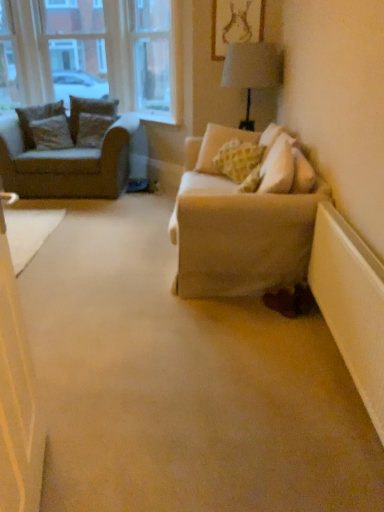
Question: From a real-world perspective, is velvet brown pillow at left, which ranks as the second pillow in right-to-left order, physically below brown textured pillow at left, the third pillow from the right?

Choices:
 (A) no
 (B) yes

Answer: (A)

Question: Is velvet brown pillow at left, which ranks as the second pillow in right-to-left order, at the right side of brown textured pillow at left, arranged as the second pillow when viewed from the left?

Choices:
 (A) no
 (B) yes

Answer: (B)

Question: Is velvet brown pillow at left, positioned as the third pillow in left-to-right order, shorter than brown textured pillow at left, arranged as the second pillow when viewed from the left?

Choices:
 (A) no
 (B) yes

Answer: (A)

Question: Is velvet brown pillow at left, which ranks as the second pillow in right-to-left order, smaller than brown textured pillow at left, arranged as the second pillow when viewed from the left?

Choices:
 (A) yes
 (B) no

Answer: (A)

Question: Is brown textured pillow at left, the third pillow from the right, inside velvet brown pillow at left, positioned as the third pillow in left-to-right order?

Choices:
 (A) yes
 (B) no

Answer: (B)

Question: Considering the positions of point (220, 9) and point (160, 88), is point (220, 9) closer or farther from the camera than point (160, 88)?

Choices:
 (A) farther
 (B) closer

Answer: (B)

Question: From the image's perspective, relative to clear glass window frame at upper left, is matte gold picture frame at upper center above or below?

Choices:
 (A) above
 (B) below

Answer: (B)

Question: Which is correct: matte gold picture frame at upper center is inside clear glass window frame at upper left, or outside of it?

Choices:
 (A) inside
 (B) outside

Answer: (B)

Question: Looking at their shapes, would you say matte gold picture frame at upper center is wider or thinner than clear glass window frame at upper left?

Choices:
 (A) thin
 (B) wide

Answer: (A)

Question: Is white plastic radiator at lower right spatially inside clear glass window frame at upper left, or outside of it?

Choices:
 (A) outside
 (B) inside

Answer: (A)

Question: Is white plastic radiator at lower right taller or shorter than clear glass window frame at upper left?

Choices:
 (A) short
 (B) tall

Answer: (A)

Question: In terms of width, does white plastic radiator at lower right look wider or thinner when compared to clear glass window frame at upper left?

Choices:
 (A) thin
 (B) wide

Answer: (A)

Question: From a real-world perspective, is white plastic radiator at lower right physically located above or below clear glass window frame at upper left?

Choices:
 (A) above
 (B) below

Answer: (B)

Question: From a real-world perspective, is clear glass window frame at upper left above or below beige fabric armchair at left?

Choices:
 (A) above
 (B) below

Answer: (A)

Question: Does point (140, 74) appear closer or farther from the camera than point (34, 161)?

Choices:
 (A) closer
 (B) farther

Answer: (B)